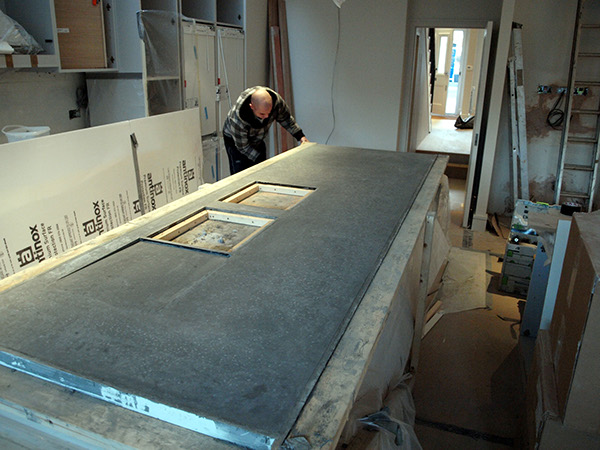
The height and width of the screenshot is (450, 600). In order to click on ladders in this screenshot , I will do `click(515, 122)`, `click(572, 131)`.